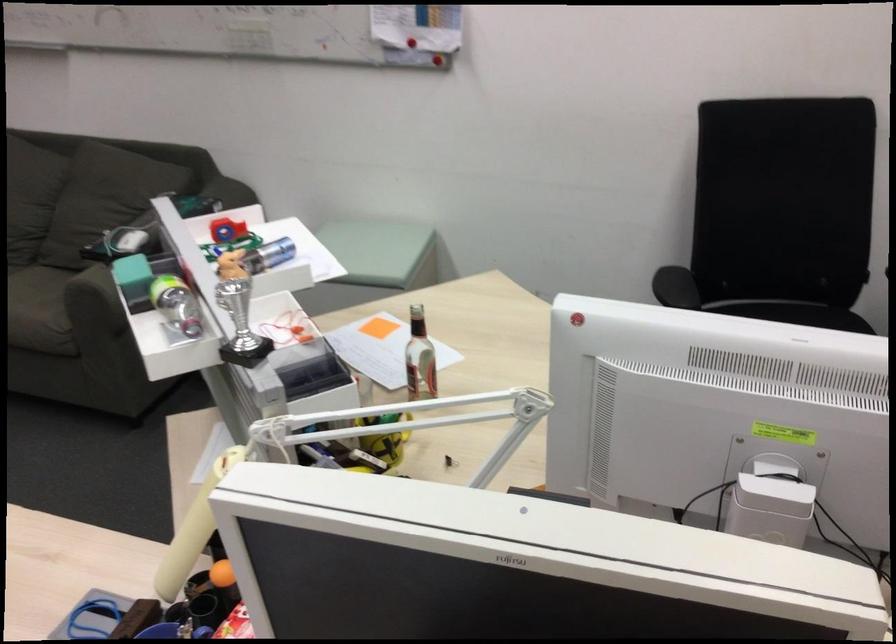
Where is `black chair armrest`? black chair armrest is located at coordinates (675, 287).